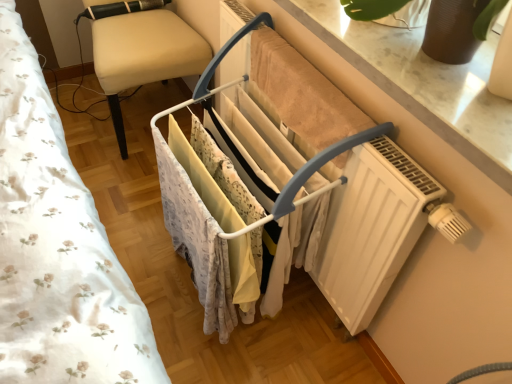
Question: Can you confirm if beige fabric chair at left is wider than white floral fabric at left?

Choices:
 (A) yes
 (B) no

Answer: (B)

Question: From a real-world perspective, is beige fabric chair at left located higher than white floral fabric at left?

Choices:
 (A) yes
 (B) no

Answer: (B)

Question: Considering the relative positions of beige fabric chair at left and white floral fabric at left in the image provided, is beige fabric chair at left to the left of white floral fabric at left from the viewer's perspective?

Choices:
 (A) yes
 (B) no

Answer: (B)

Question: From a real-world perspective, is beige fabric chair at left below white floral fabric at left?

Choices:
 (A) no
 (B) yes

Answer: (B)

Question: Is beige fabric chair at left positioned behind white floral fabric at left?

Choices:
 (A) no
 (B) yes

Answer: (B)

Question: From a real-world perspective, is white floral fabric at left above or below beige fabric chair at left?

Choices:
 (A) above
 (B) below

Answer: (A)

Question: Considering the positions of white floral fabric at left and beige fabric chair at left in the image, is white floral fabric at left bigger or smaller than beige fabric chair at left?

Choices:
 (A) small
 (B) big

Answer: (A)

Question: Is white floral fabric at left in front of or behind beige fabric chair at left in the image?

Choices:
 (A) behind
 (B) front

Answer: (B)

Question: Considering the positions of point click(x=148, y=372) and point click(x=121, y=59), is point click(x=148, y=372) closer or farther from the camera than point click(x=121, y=59)?

Choices:
 (A) closer
 (B) farther

Answer: (A)

Question: In terms of size, does beige fabric chair at left appear bigger or smaller than white floral fabric at left?

Choices:
 (A) small
 (B) big

Answer: (B)

Question: Considering the positions of beige fabric chair at left and white floral fabric at left in the image, is beige fabric chair at left taller or shorter than white floral fabric at left?

Choices:
 (A) short
 (B) tall

Answer: (A)

Question: Considering the relative positions of beige fabric chair at left and white floral fabric at left in the image provided, is beige fabric chair at left to the left or to the right of white floral fabric at left?

Choices:
 (A) right
 (B) left

Answer: (A)

Question: Does point (108, 49) appear closer or farther from the camera than point (145, 380)?

Choices:
 (A) farther
 (B) closer

Answer: (A)

Question: Considering the positions of point (67, 289) and point (222, 213), is point (67, 289) closer or farther from the camera than point (222, 213)?

Choices:
 (A) farther
 (B) closer

Answer: (B)

Question: In terms of width, does white floral fabric at left look wider or thinner when compared to white matte clothes rack at center?

Choices:
 (A) thin
 (B) wide

Answer: (B)